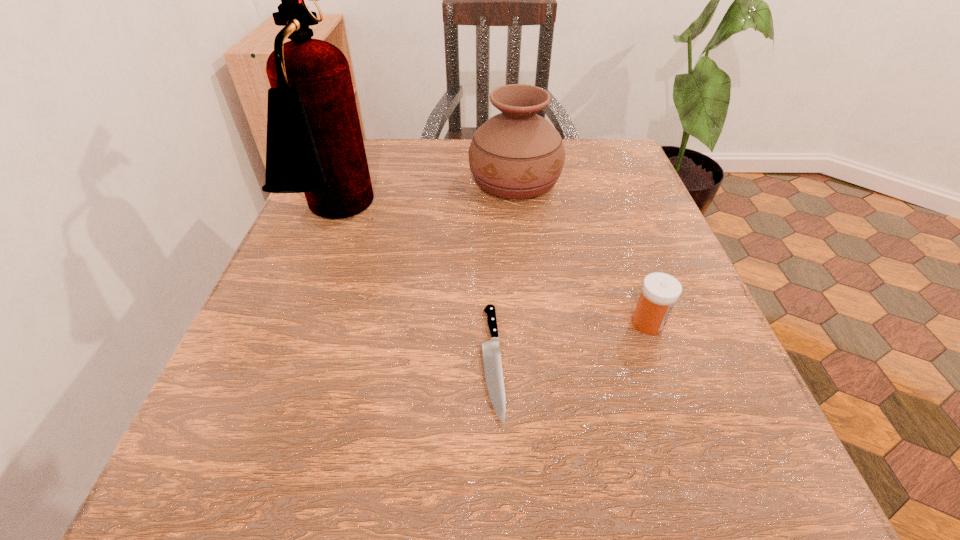
This screenshot has height=540, width=960. Identify the location of the tallest object. (314, 145).

Where is `fire extinguisher`? The image size is (960, 540). fire extinguisher is located at coordinates (314, 145).

This screenshot has height=540, width=960. I want to click on urn, so coord(517,154).

The width and height of the screenshot is (960, 540). I want to click on the rightmost object, so click(660, 291).

This screenshot has width=960, height=540. Identify the location of medicine. (660, 291).

Locate an element on the screen. steak knife is located at coordinates (492, 363).

This screenshot has height=540, width=960. Identify the location of vacant space located at the nozzle of the leftmost object. (533, 215).

This screenshot has width=960, height=540. What are the coordinates of `free point located on the back of the third shortest object` in the screenshot? It's located at (511, 145).

Identify the location of vacant area situated on the left of the medicine. (388, 323).

Where is `free space located 0.290m on the left of the steak knife`? The height and width of the screenshot is (540, 960). free space located 0.290m on the left of the steak knife is located at coordinates click(x=281, y=361).